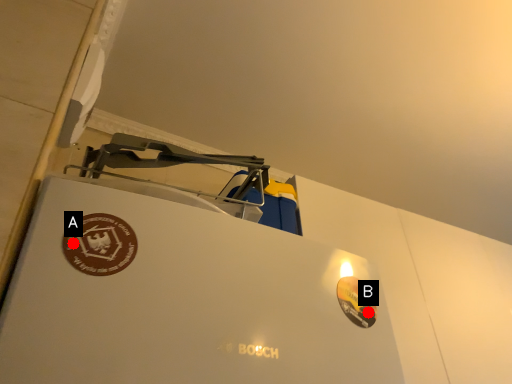
Question: Two points are circled on the image, labeled by A and B beside each circle. Among these points, which one is nearest to the camera?

Choices:
 (A) A is closer
 (B) B is closer

Answer: (A)